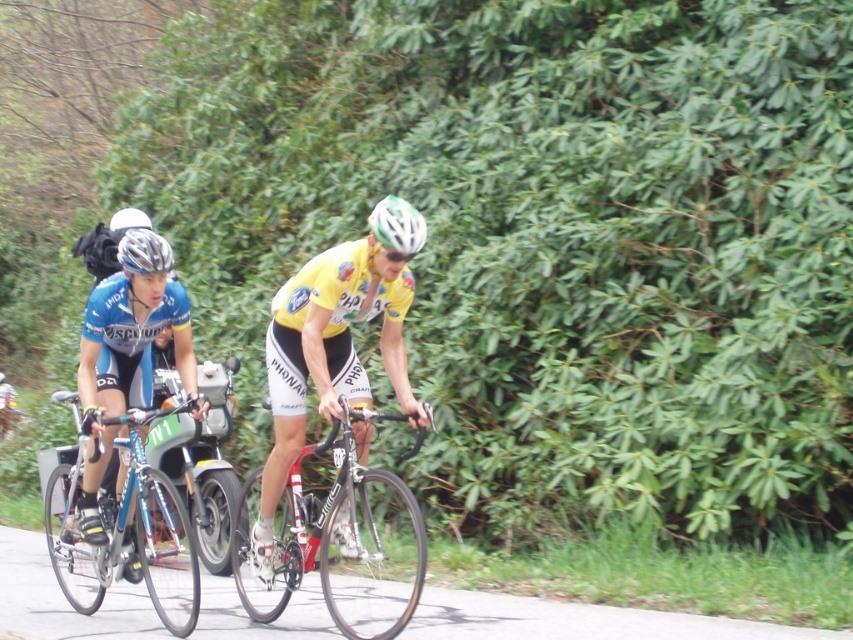
Can you confirm if yellow jersey at center is positioned to the right of blue matte cycling jersey at left?

Correct, you'll find yellow jersey at center to the right of blue matte cycling jersey at left.

At what (x,y) coordinates should I click in order to perform the action: click on yellow jersey at center. Please return your answer as a coordinate pair (x, y). This screenshot has width=853, height=640. Looking at the image, I should click on (335, 342).

Is blue matte cycling jersey at left positioned before green matte bicycle helmet at center?

No, blue matte cycling jersey at left is behind green matte bicycle helmet at center.

Describe the element at coordinates (132, 330) in the screenshot. I see `blue matte cycling jersey at left` at that location.

Identify the location of blue matte cycling jersey at left. Image resolution: width=853 pixels, height=640 pixels. (132, 330).

Does yellow jersey at center have a smaller size compared to shiny black frame at center?

Yes, yellow jersey at center is smaller than shiny black frame at center.

This screenshot has width=853, height=640. What do you see at coordinates (335, 342) in the screenshot? I see `yellow jersey at center` at bounding box center [335, 342].

Who is more forward, (339,387) or (405,458)?

Point (339,387) is in front.

This screenshot has width=853, height=640. Identify the location of yellow jersey at center. (335, 342).